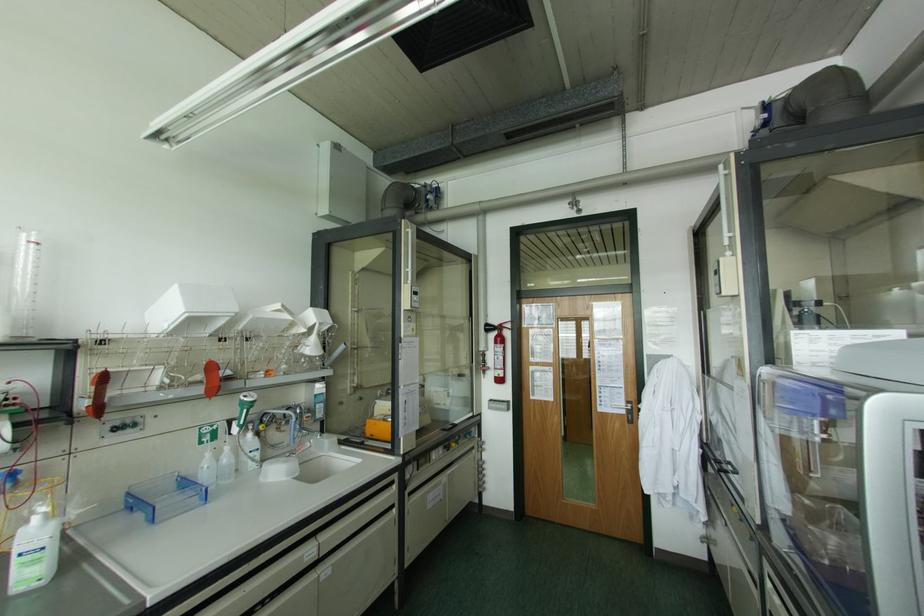
Find the location of a particular element. The height and width of the screenshot is (616, 924). orange device knob is located at coordinates (99, 394).